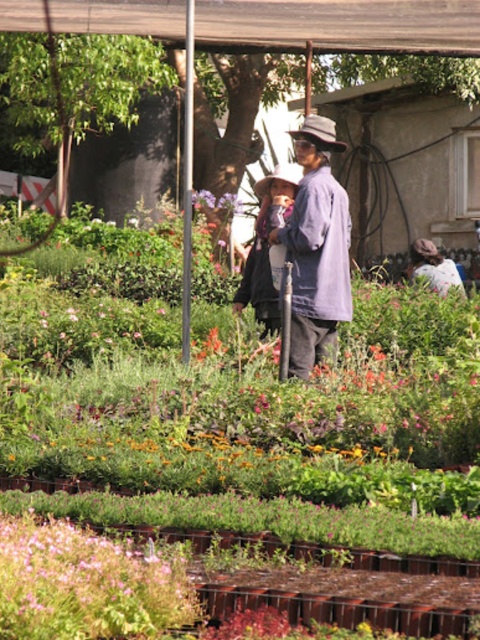
Is pink matte flower at lower left taller than matte gray fedora at center?

No, pink matte flower at lower left is not taller than matte gray fedora at center.

How distant is pink matte flower at lower left from matte gray fedora at center?

pink matte flower at lower left is 5.84 meters from matte gray fedora at center.

I want to click on pink matte flower at lower left, so click(86, 584).

Is matte black jacket at center shorter than matte gray fedora at center?

Yes.

What do you see at coordinates (266, 244) in the screenshot?
I see `matte black jacket at center` at bounding box center [266, 244].

This screenshot has width=480, height=640. Find the location of `matte black jacket at center`. matte black jacket at center is located at coordinates (266, 244).

Between pink matte flower at lower left and denim shirt at center, which one is positioned lower?

pink matte flower at lower left is below.

Is pink matte flower at lower left positioned before denim shirt at center?

Yes, pink matte flower at lower left is in front of denim shirt at center.

This screenshot has height=640, width=480. Describe the element at coordinates (86, 584) in the screenshot. I see `pink matte flower at lower left` at that location.

Where is `pink matte flower at lower left`? pink matte flower at lower left is located at coordinates (86, 584).